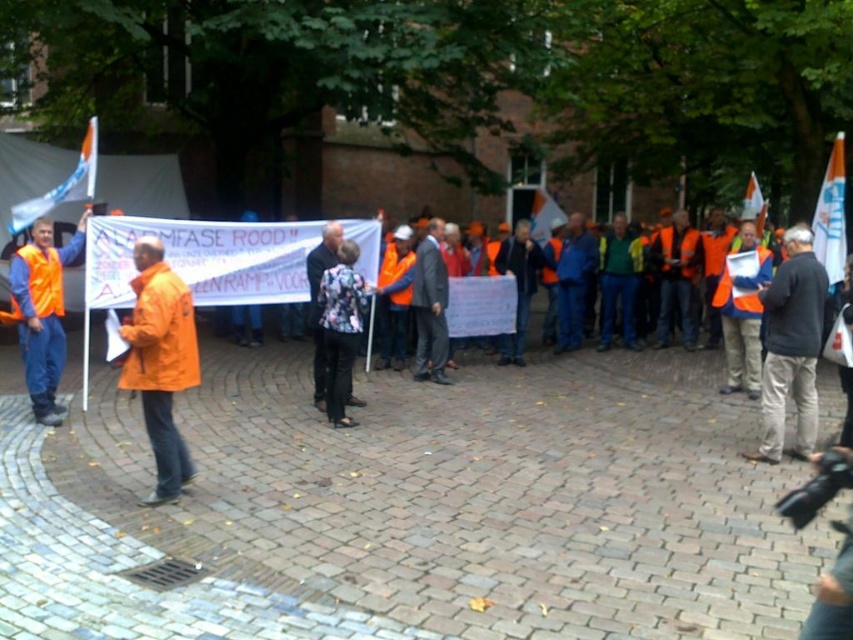
Looking at this image, you are a photographer trying to capture a photo of the orange reflective vest at left and the dark gray jacket at center. From the photographer perspective, which object is on the left side?

The orange reflective vest at left is on the left side because the dark gray jacket at center is positioned on the right side of it.

Based on the photo, you are a photographer standing at the edge of the protest area. You want to take a closeup shot of the orange matte jacket at center without moving closer. Your camera has a zoom range of 10x. Can you capture the jacket clearly?

The orange matte jacket at center is 5.64 meters away. With a 10x zoom, the camera can magnify the subject sufficiently to capture the jacket clearly from that distance.

You are a photographer trying to capture a photo of the orange reflective vest at left and the dark gray jacket at center. Based on their positions, which object should you focus on first to ensure both are in the frame?

The dark gray jacket at center is located below the orange reflective vest at left, so you should focus on the orange reflective vest at left first to ensure both are in the frame.